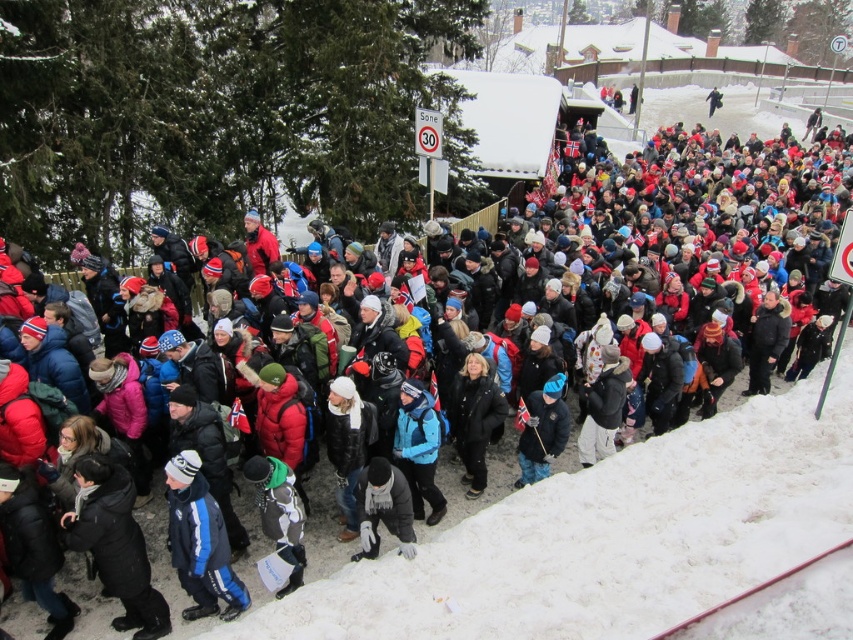
What do you see at coordinates (115, 544) in the screenshot? I see `black matte coat at lower left` at bounding box center [115, 544].

Which is behind, point (119, 624) or point (595, 420)?

Point (595, 420)

The height and width of the screenshot is (640, 853). What do you see at coordinates (115, 544) in the screenshot?
I see `black matte coat at lower left` at bounding box center [115, 544].

Locate an element on the screen. black matte coat at lower left is located at coordinates (115, 544).

Does point (276, 602) come farther from viewer compared to point (584, 440)?

No, it is in front of (584, 440).

Between white snow at center and dark gray jacket at center, which one is positioned higher?

Positioned higher is dark gray jacket at center.

The width and height of the screenshot is (853, 640). Describe the element at coordinates (608, 538) in the screenshot. I see `white snow at center` at that location.

You are a GUI agent. You are given a task and a screenshot of the screen. Output one action in this format:
    pyautogui.click(x=<x>, y=<y>)
    Task: Click on the white snow at center
    This screenshot has width=853, height=640.
    Given the screenshot: What is the action you would take?
    tap(608, 538)

Can you confirm if black matte coat at lower left is bigger than dark gray wool scarf at center?

Correct, black matte coat at lower left is larger in size than dark gray wool scarf at center.

Between black matte coat at lower left and dark gray wool scarf at center, which one is positioned higher?

dark gray wool scarf at center

Describe the element at coordinates (115, 544) in the screenshot. I see `black matte coat at lower left` at that location.

This screenshot has height=640, width=853. I want to click on black matte coat at lower left, so click(115, 544).